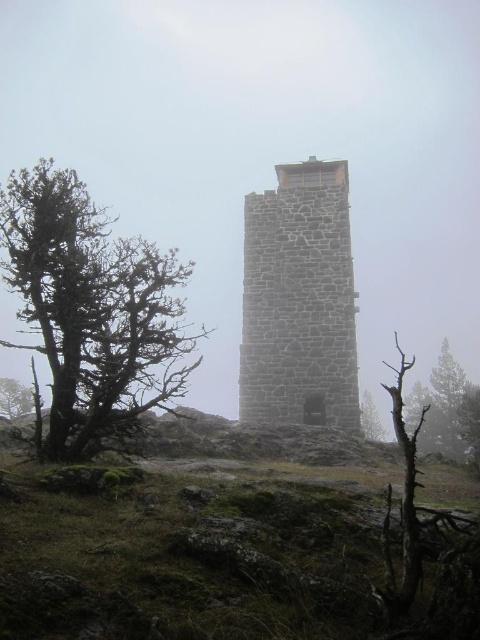
Question: Considering the real-world distances, which object is farthest from the bare wood tree at center?

Choices:
 (A) stone tower at center
 (B) green leafy tree at left
 (C) bare wood tree at left
 (D) brown textured tree at lower right

Answer: (B)

Question: Is bare wood tree at left to the left of green leafy tree at left from the viewer's perspective?

Choices:
 (A) yes
 (B) no

Answer: (B)

Question: Considering the real-world distances, which object is closest to the bare wood tree at center?

Choices:
 (A) stone tower at center
 (B) bare wood tree at left
 (C) green leafy tree at left
 (D) brown textured tree at lower right

Answer: (D)

Question: Is the position of bare wood tree at left more distant than that of brown textured tree at lower right?

Choices:
 (A) no
 (B) yes

Answer: (A)

Question: Does green leafy tree at left appear over bare wood tree at center?

Choices:
 (A) yes
 (B) no

Answer: (A)

Question: Estimate the real-world distances between objects in this image. Which object is farther from the brown textured tree at lower right?

Choices:
 (A) green leafy tree at left
 (B) bare wood tree at center
 (C) stone tower at center
 (D) bare wood tree at left

Answer: (A)